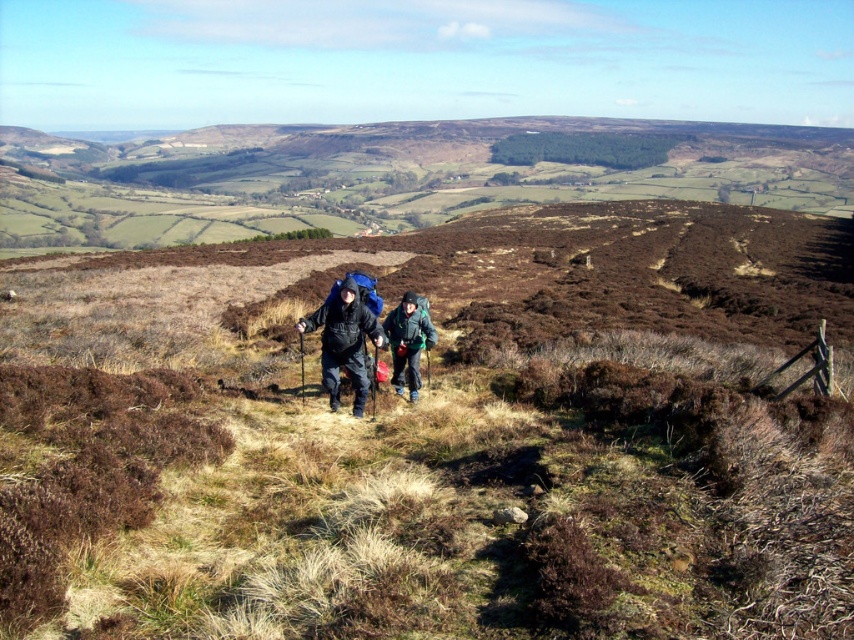
You are a hiker trying to navigate the rugged hillside. You notice the brown dry grass at center and the dark green fabric jacket at center. Which object is positioned more to the left from your perspective?

The brown dry grass at center is to the left of the dark green fabric jacket at center, so the brown dry grass at center is more to the left.

You are a hiker trying to locate your items. You see the matte black backpack at center and the dark green fabric jacket at center. Which item is positioned to the right?

The dark green fabric jacket at center is positioned to the right of the matte black backpack at center.